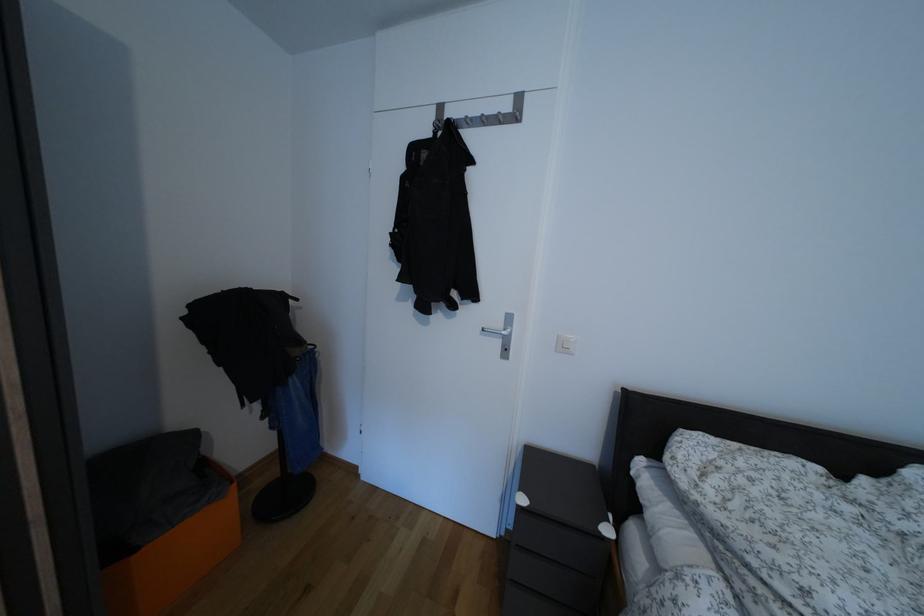
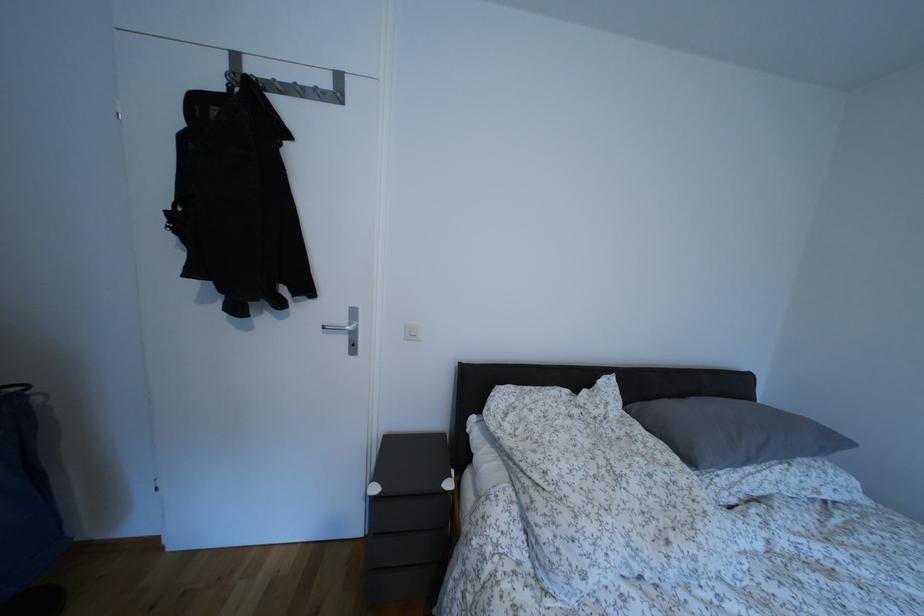
Where in the second image is the point corresponding to (505,329) from the first image?

(348, 325)